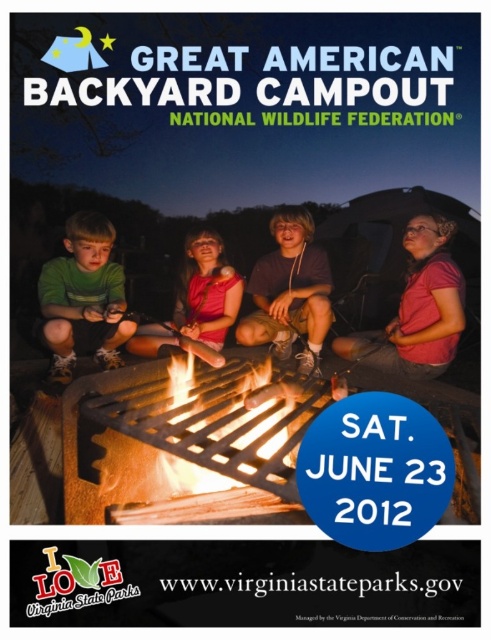
Is green matte shirt at center closer to camera compared to matte pink shirt at center?

Yes, it is in front of matte pink shirt at center.

Can you confirm if green matte shirt at center is shorter than matte pink shirt at center?

Yes.

The image size is (491, 640). I want to click on green matte shirt at center, so pyautogui.click(x=83, y=298).

Between green matte shirt at center and pink fabric dress at center, which one has more height?

green matte shirt at center

Is green matte shirt at center thinner than pink fabric dress at center?

Indeed, green matte shirt at center has a lesser width compared to pink fabric dress at center.

Does point (86, 337) come closer to viewer compared to point (147, 353)?

Yes, it is.

The height and width of the screenshot is (640, 491). Identify the location of green matte shirt at center. (83, 298).

Is matte pink shirt at center to the right of pink fabric dress at center from the viewer's perspective?

Correct, you'll find matte pink shirt at center to the right of pink fabric dress at center.

Is matte pink shirt at center further to camera compared to pink fabric dress at center?

That is False.

Does point (281, 323) come in front of point (207, 282)?

Yes, point (281, 323) is closer to viewer.

What are the coordinates of `matte pink shirt at center` in the screenshot? It's located at (290, 291).